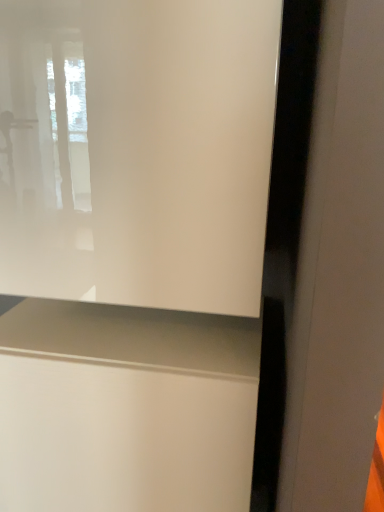
The height and width of the screenshot is (512, 384). Find the location of `free space above matte white vanity at lower center (from a real-world perspective)`. free space above matte white vanity at lower center (from a real-world perspective) is located at coordinates (103, 323).